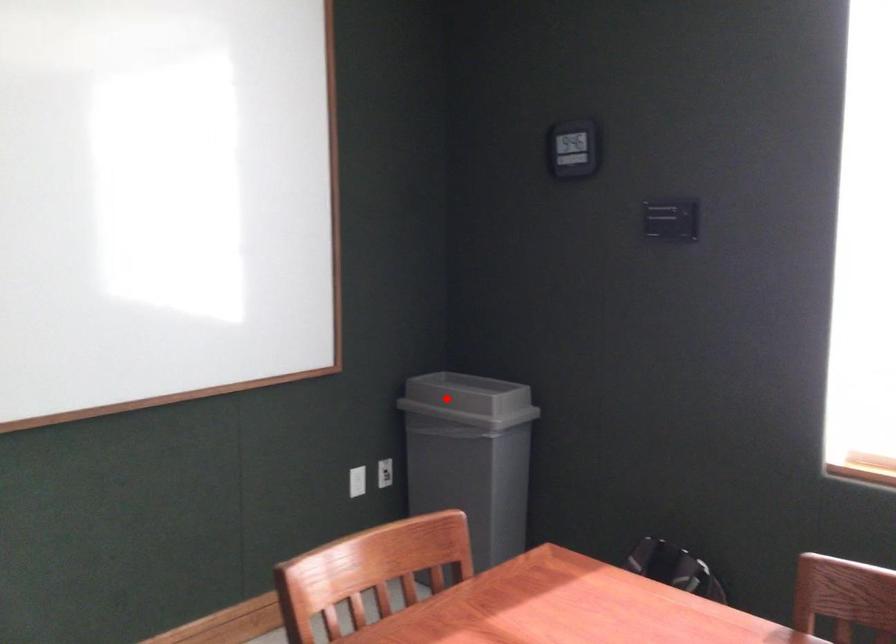
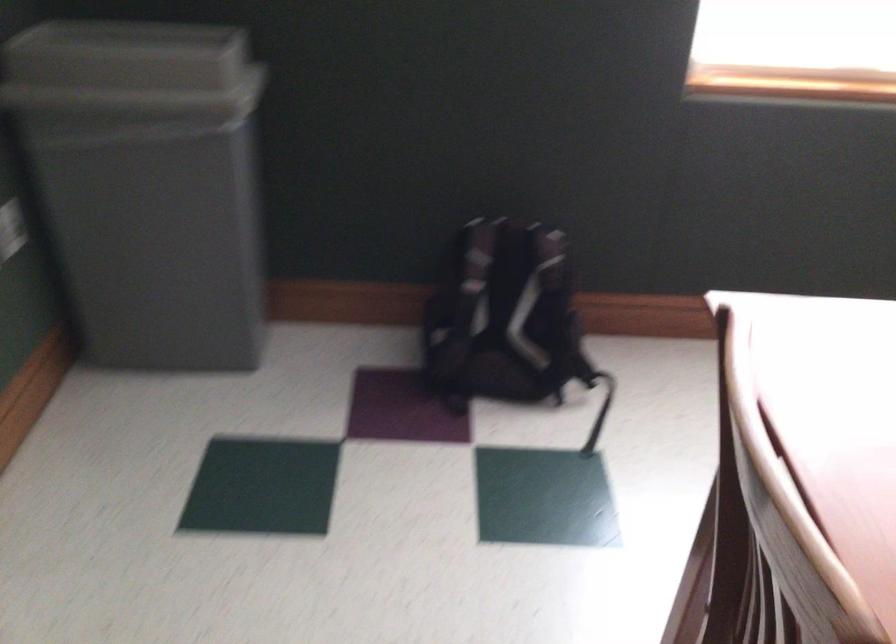
Question: I am providing you with two images of the same scene from different viewpoints. A red point is shown in image1. For the corresponding object point in image2, is it positioned nearer or farther from the camera?

Choices:
 (A) Nearer
 (B) Farther

Answer: (A)